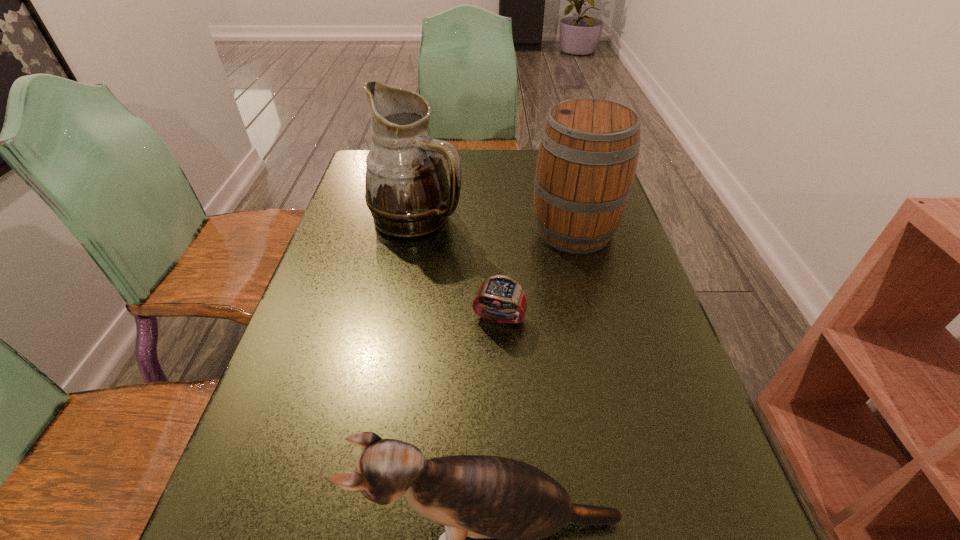
Locate an element on the screen. pitcher is located at coordinates (407, 192).

Image resolution: width=960 pixels, height=540 pixels. Identify the location of cider. (589, 148).

At what (x,y) coordinates should I click in order to perform the action: click on the second nearest object. Please return your answer as a coordinate pair (x, y). Image resolution: width=960 pixels, height=540 pixels. Looking at the image, I should click on (499, 292).

The image size is (960, 540). What are the coordinates of `the shortest object` in the screenshot? It's located at (499, 292).

Find the location of a particular element. vacant space located 0.180m from the spout of the pitcher is located at coordinates (529, 218).

Where is `free region located 0.380m on the front of the cider`? This screenshot has width=960, height=540. free region located 0.380m on the front of the cider is located at coordinates (615, 389).

This screenshot has height=540, width=960. In order to click on free location located on the back of the second nearest object in this screenshot , I will do `click(495, 217)`.

At what (x,y) coordinates should I click in order to perform the action: click on object present at the left edge. Please return your answer as a coordinate pair (x, y). The image size is (960, 540). Looking at the image, I should click on (407, 192).

Locate an element on the screen. The height and width of the screenshot is (540, 960). object present at the right edge is located at coordinates (589, 148).

This screenshot has height=540, width=960. I want to click on vacant space at the left edge, so click(x=257, y=533).